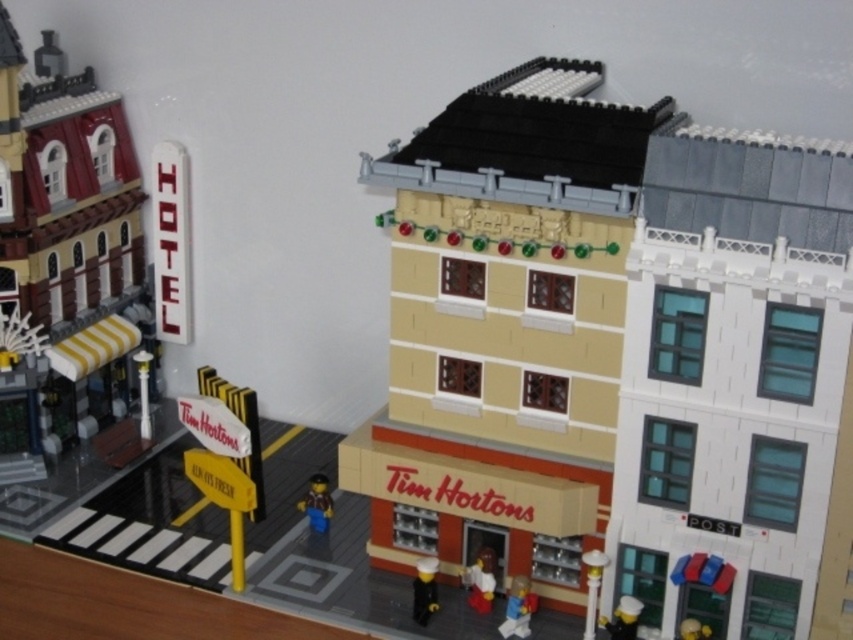
Who is taller, smooth plastic figure at lower center or yellow matte toy at lower right?

smooth plastic figure at lower center is taller.

Which of these two, smooth plastic figure at lower center or yellow matte toy at lower right, stands shorter?

Standing shorter between the two is yellow matte toy at lower right.

Does point (503, 634) lie behind point (701, 632)?

Yes.

Where is `smooth plastic figure at lower center`? smooth plastic figure at lower center is located at coordinates (517, 609).

Which is below, black plastic toy at lower right or yellow matte toy at lower right?

yellow matte toy at lower right is lower down.

Image resolution: width=853 pixels, height=640 pixels. In order to click on black plastic toy at lower right in this screenshot , I will do `click(624, 618)`.

Is yellow striped awning at left positioned at the back of smooth plastic figure at lower center?

That is True.

Can you confirm if yellow striped awning at left is positioned to the right of smooth plastic figure at lower center?

In fact, yellow striped awning at left is to the left of smooth plastic figure at lower center.

Is point (67, 204) farther from camera compared to point (514, 596)?

Yes, it is.

Locate an element on the screen. The height and width of the screenshot is (640, 853). yellow striped awning at left is located at coordinates (61, 240).